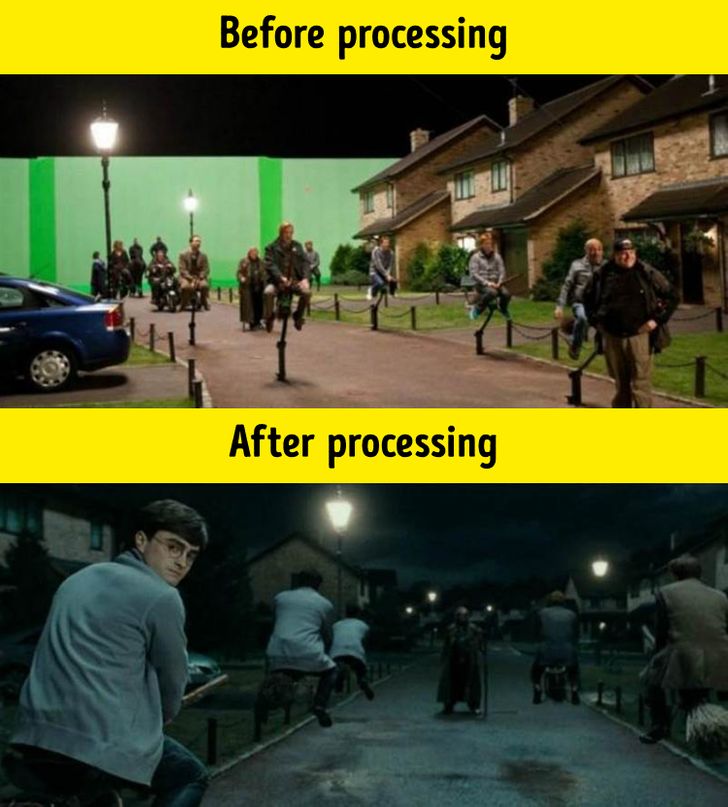
Where is `broomstick handle`? broomstick handle is located at coordinates pyautogui.click(x=646, y=633), pyautogui.click(x=205, y=684), pyautogui.click(x=510, y=274), pyautogui.click(x=288, y=279), pyautogui.click(x=394, y=278).